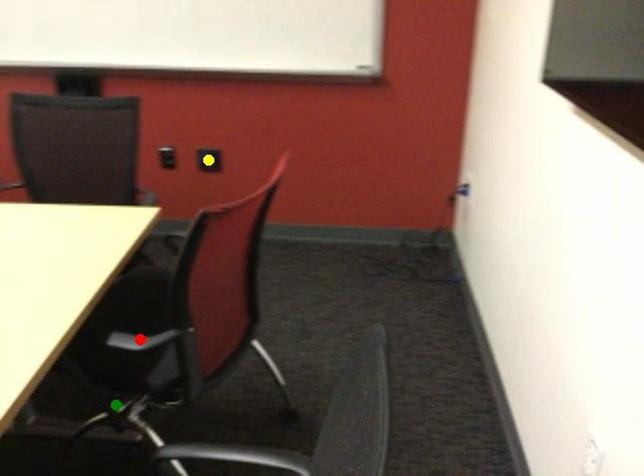
Order these from nearest to farthest:
1. green point
2. red point
3. yellow point

red point
green point
yellow point